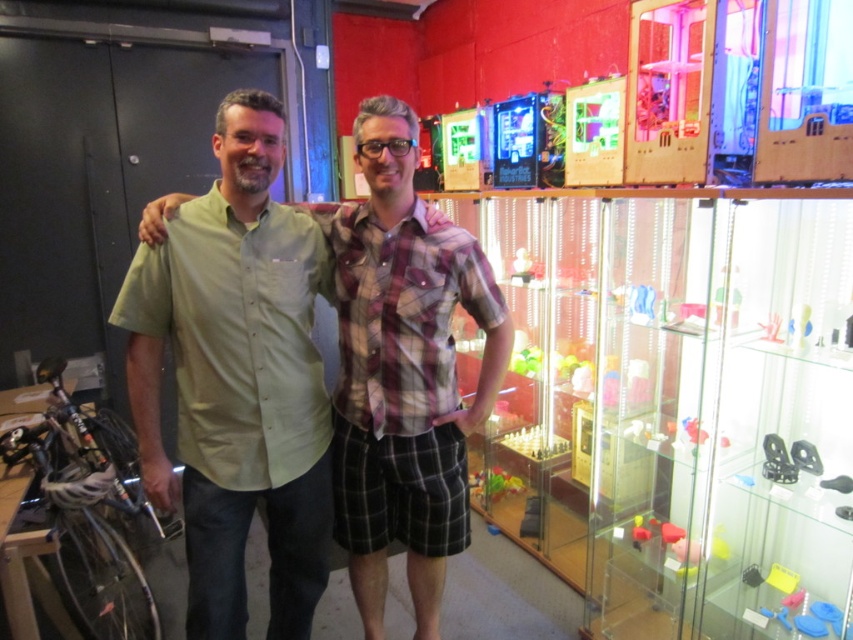
You are a photographer trying to capture the clear acrylic display case at right and the green cotton shirt at center. Which object is closer to the camera?

The clear acrylic display case at right is positioned over the green cotton shirt at center, meaning it is closer to the camera.

Based on the photo, you are a delivery person who needs to place a package between the clear acrylic display case at right and the green cotton shirt at center. The package is 90 centimeters long. Will it fit in the space between them?

The clear acrylic display case at right and green cotton shirt at center are 91.38 centimeters apart. Since the package is 90 centimeters long, it will fit in the space between them as there is enough room.